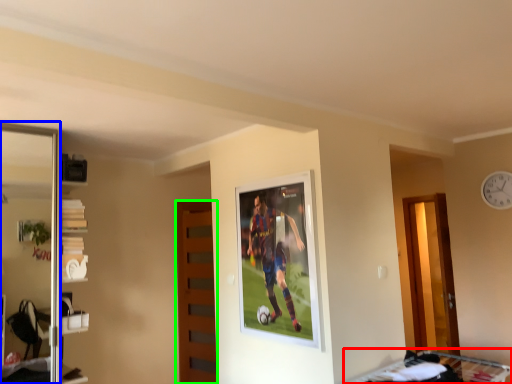
Question: Considering the real-world distances, which object is farthest from bunk bed (highlighted by a red box)? screen door (highlighted by a blue box) or door (highlighted by a green box)?

Choices:
 (A) screen door
 (B) door

Answer: (A)